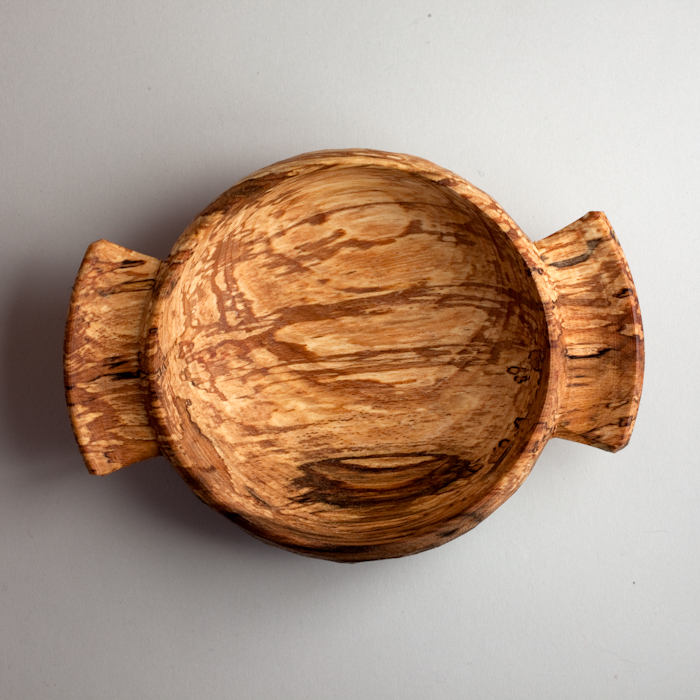
This screenshot has height=700, width=700. I want to click on bowl, so click(325, 356).